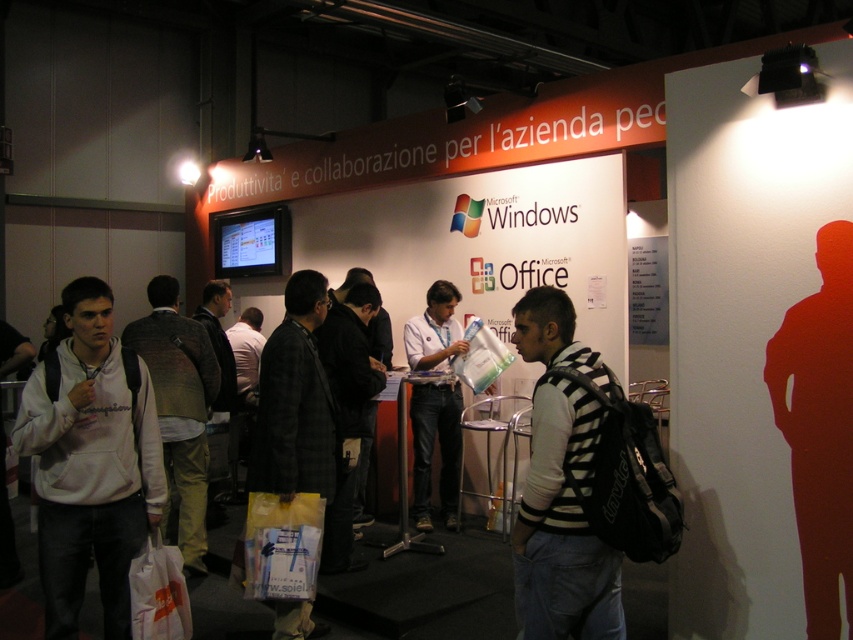
You are a photographer at the event and want to capture a photo of the dark gray plaid jacket at center and the khaki cotton pants at center. Which object should you focus on first if you want to ensure both are in focus, considering their positions relative to the camera?

The dark gray plaid jacket at center has a greater height compared to khaki cotton pants at center. Since the jacket is taller, it is positioned closer to the camera, so focusing on it first will help ensure both are in focus.

You are standing at the point marked by the coordinate point at point (x=56, y=474). You want to move to the booth entrance, which is 9.05 feet away. If your stride length is 2.5 feet per step, how many steps will it take you to reach the booth entrance?

Since the distance to the booth entrance is 9.05 feet and each step covers 2.5 feet, dividing 9.05 by 2.5 gives approximately 3.62 steps. Since you can only take whole steps, you would need 4 steps to reach the booth entrance.